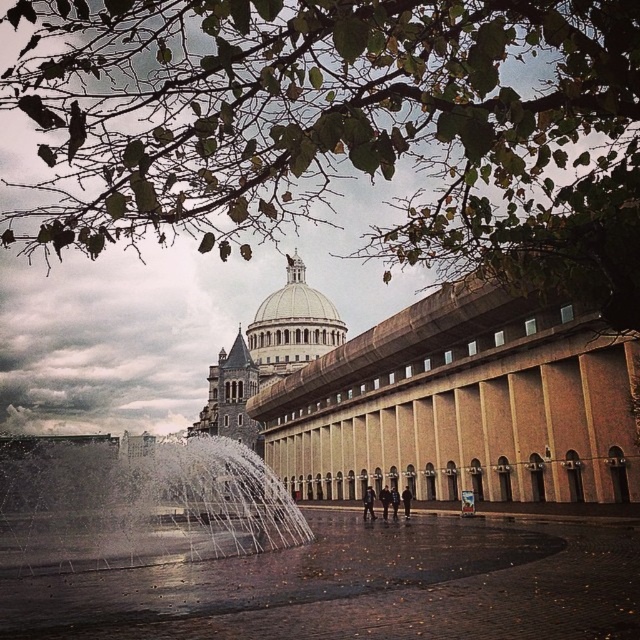
Question: Is dark gray fabric coat at center positioned behind dark brown leather jacket at center?

Choices:
 (A) yes
 (B) no

Answer: (B)

Question: Which point is closer to the camera taking this photo?

Choices:
 (A) (371, 516)
 (B) (401, 497)
 (C) (388, 490)

Answer: (C)

Question: Which is nearer to the white water at center?

Choices:
 (A) dark gray fabric coat at center
 (B) dark brown leather jacket at center
 (C) dark blue leather jacket at center
 (D) dark blue jeans at center

Answer: (C)

Question: Is white stone dome at center further to the viewer compared to dark blue leather jacket at center?

Choices:
 (A) yes
 (B) no

Answer: (A)

Question: Does white stone dome at center have a larger size compared to dark gray fabric coat at center?

Choices:
 (A) yes
 (B) no

Answer: (A)

Question: Which of the following is the closest to the observer?

Choices:
 (A) (396, 493)
 (B) (384, 497)
 (C) (320, 294)
 (D) (406, 499)

Answer: (D)